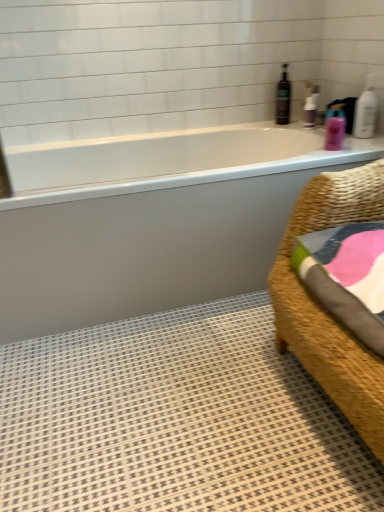
I want to click on vacant area on top of white textured bath mat at lower right (from a real-world perspective), so (x=173, y=398).